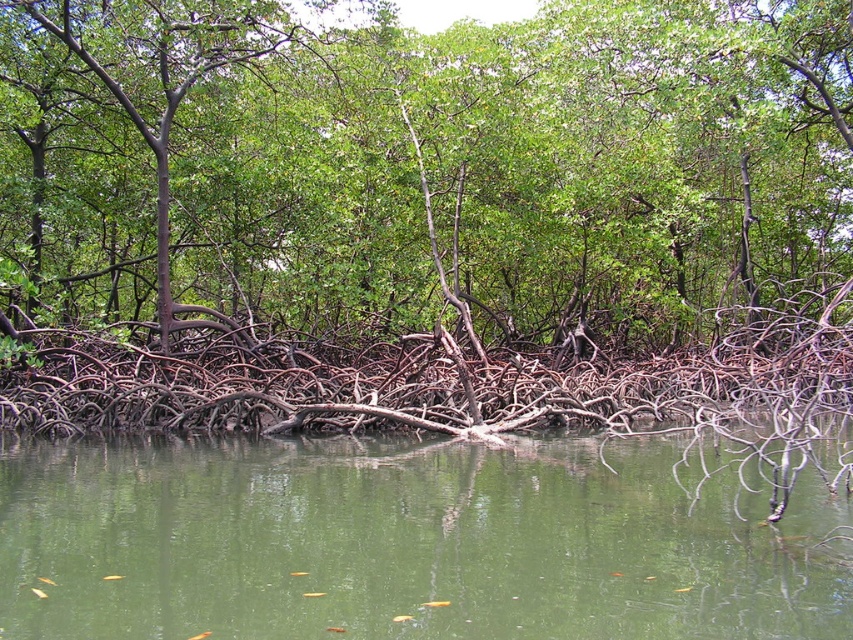
You are a small frog attempting to jump from the brown rough tree roots at center to the green murky water at lower center. Can you land safely without getting submerged immediately?

The brown rough tree roots at center are taller than the green murky water at lower center. Since the roots are higher, the frog can jump down to the water without submerging immediately as the water level is lower.

You are a researcher standing at the edge of the mangrove forest. You need to collect samples from both the brown rough tree roots at center and the green matte tree at center. If your collection kit can only hold items within a 5 meter radius, will you be able to collect both without moving your position?

The brown rough tree roots at center is 4.40 meters away from the green matte tree at center. Since the distance between them is within the 5 meter radius of your collection kit, you can collect both samples without moving your position.

You are a small frog trying to jump from the brown rough tree roots at center to the green murky water at lower center. Which one has a larger surface area for you to land on?

The brown rough tree roots at center has a larger surface area than the green murky water at lower center, so you should aim for the brown rough tree roots at center to land safely.